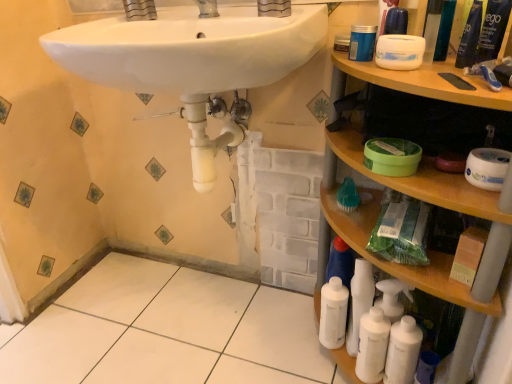
Locate an element on the screen. blank space situated above wooden cabinet at right (from a real-world perspective) is located at coordinates (428, 67).